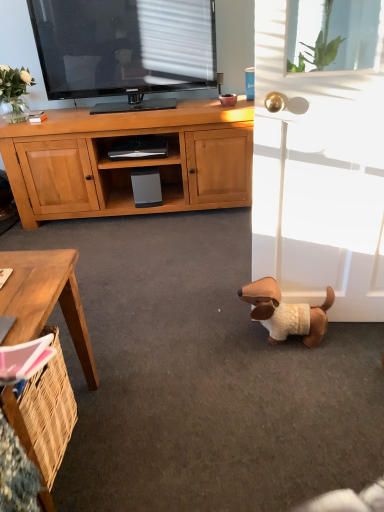
Locate an element on the screen. The height and width of the screenshot is (512, 384). vacant space behind brown wooden desk at lower left is located at coordinates (122, 339).